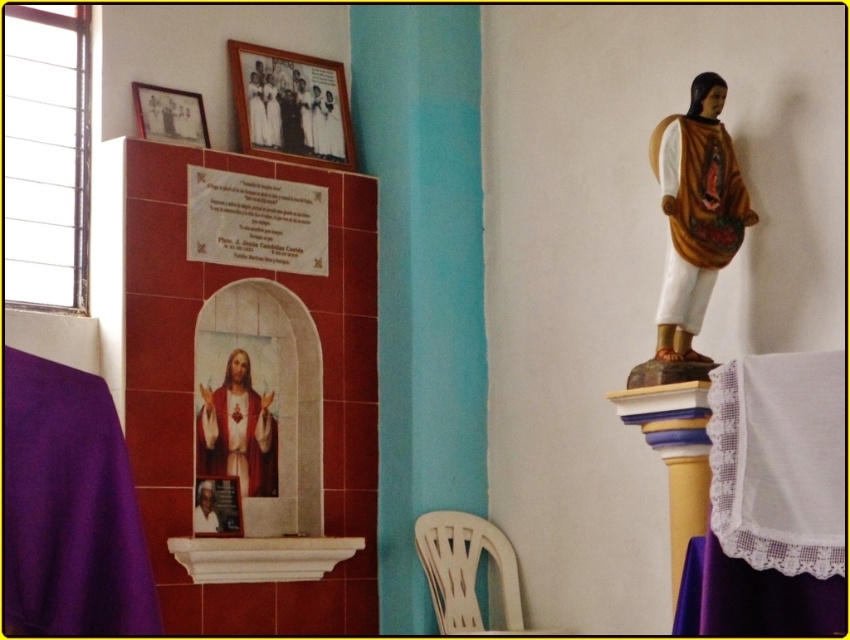
In the scene shown: Between smooth wooden crucifix at center and matte gold robe at upper center, which one is positioned lower?

smooth wooden crucifix at center

Can you confirm if smooth wooden crucifix at center is shorter than matte gold robe at upper center?

In fact, smooth wooden crucifix at center may be taller than matte gold robe at upper center.

Is point (239, 467) less distant than point (264, 128)?

Yes, it is.

Identify the location of smooth wooden crucifix at center. The height and width of the screenshot is (640, 850). pyautogui.click(x=238, y=429).

Between point (255, 140) and point (267, 109), which one is positioned behind?

Positioned behind is point (267, 109).

Is point (262, 132) positioned in front of point (267, 122)?

Yes, point (262, 132) is closer to viewer.

Describe the element at coordinates (256, 112) in the screenshot. The height and width of the screenshot is (640, 850). I see `matte gold robe at upper center` at that location.

Identify the location of matte gold robe at upper center. (256, 112).

Who is taller, smooth wooden crucifix at center or white matte robe at upper center?

smooth wooden crucifix at center is taller.

Describe the element at coordinates (238, 429) in the screenshot. I see `smooth wooden crucifix at center` at that location.

Is point (217, 456) closer to camera compared to point (265, 92)?

Yes, it is in front of point (265, 92).

Where is `smooth wooden crucifix at center`? The width and height of the screenshot is (850, 640). smooth wooden crucifix at center is located at coordinates (238, 429).